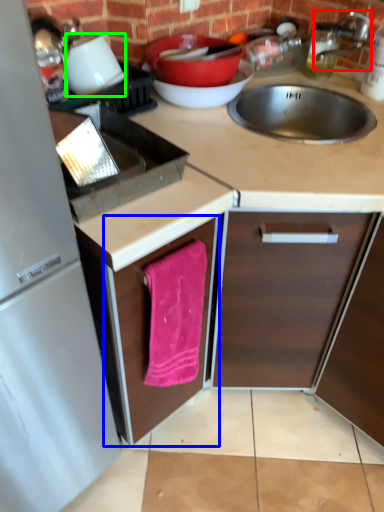
Question: Estimate the real-world distances between objects in this image. Which object is farther from faucet (highlighted by a red box), cabinetry (highlighted by a blue box) or appliance (highlighted by a green box)?

Choices:
 (A) cabinetry
 (B) appliance

Answer: (A)